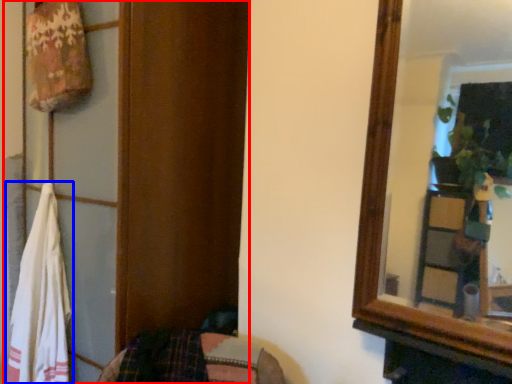
Question: Which of the following is the closest to the observer, dresser (highlighted by a red box) or beach towel (highlighted by a blue box)?

Choices:
 (A) dresser
 (B) beach towel

Answer: (A)